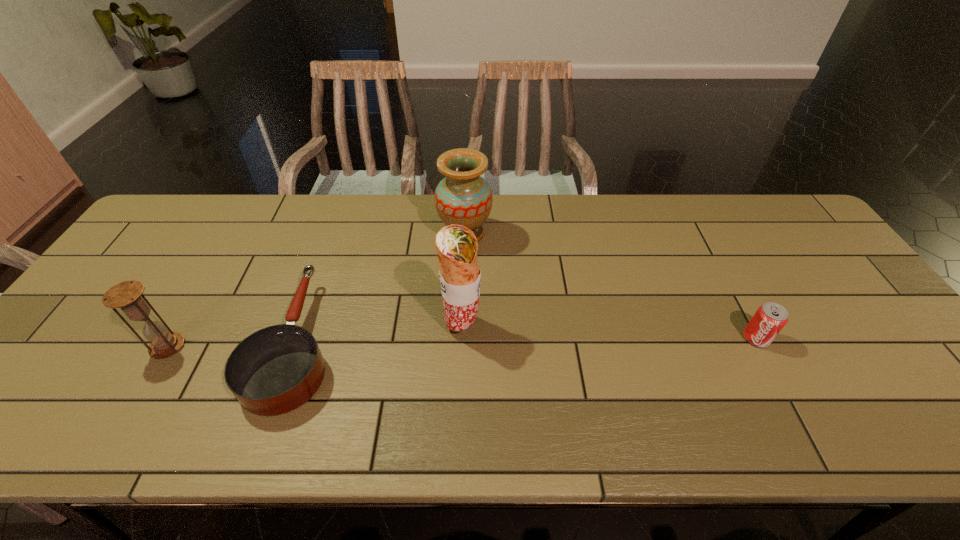
The width and height of the screenshot is (960, 540). In order to click on free space between the shortest object and the soda can in this screenshot , I will do `click(526, 340)`.

Locate an element on the screen. object that can be found as the closest to the burrito is located at coordinates (463, 197).

I want to click on object that is the third closest to the rightmost object, so [275, 370].

This screenshot has height=540, width=960. I want to click on blank area in the image that satisfies the following two spatial constraints: 1. on the handle side of the shortest object; 2. on the left side of the fourth shortest object, so click(335, 234).

I want to click on free space that satisfies the following two spatial constraints: 1. on the front side of the burrito; 2. on the right side of the farthest object, so click(462, 326).

Identify the location of free space that satisfies the following two spatial constraints: 1. on the handle side of the shortest object; 2. on the right side of the burrito. (302, 326).

What are the coordinates of `vacant space that satisfies the following two spatial constraints: 1. on the front side of the rightmost object; 2. on the right side of the vase` in the screenshot? It's located at (461, 338).

Locate an element on the screen. This screenshot has height=540, width=960. vacant space that satisfies the following two spatial constraints: 1. on the handle side of the shortest object; 2. on the left side of the burrito is located at coordinates (302, 326).

You are a GUI agent. You are given a task and a screenshot of the screen. Output one action in this format:
    pyautogui.click(x=<x>, y=<y>)
    Task: Click on the vacant area in the image that satisfies the following two spatial constraints: 1. on the handle side of the pan; 2. on the left side of the farthest object
    This screenshot has height=540, width=960.
    Given the screenshot: What is the action you would take?
    pyautogui.click(x=335, y=234)